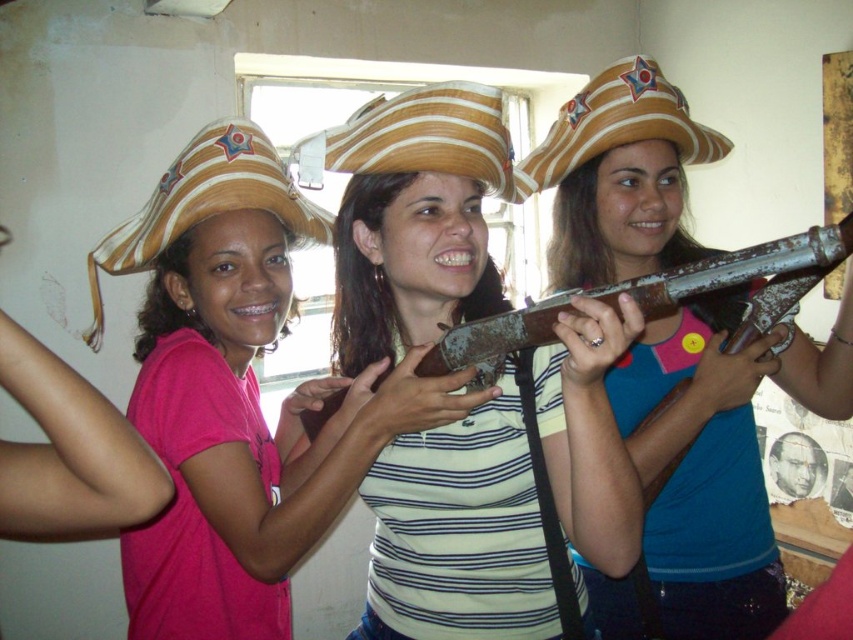
Question: From the image, what is the correct spatial relationship of matte brown rifle at center in relation to rusty metal shotgun at center?

Choices:
 (A) right
 (B) left

Answer: (B)

Question: Which point is farther to the camera?

Choices:
 (A) matte brown rifle at center
 (B) straw cowboy hat at left
 (C) rusty metal shotgun at center
 (D) matte brown hat at center

Answer: (B)

Question: Based on their relative distances, which object is nearer to the straw hat at center?

Choices:
 (A) rusty metal shotgun at center
 (B) straw cowboy hat at left
 (C) matte brown hat at center

Answer: (A)

Question: Is matte brown rifle at center to the left of straw hat with star emblem at upper right from the viewer's perspective?

Choices:
 (A) yes
 (B) no

Answer: (A)

Question: Which of the following is the closest to the observer?

Choices:
 (A) (428, 125)
 (B) (590, 147)
 (C) (190, 161)

Answer: (A)

Question: Considering the relative positions of matte brown rifle at center and straw hat with star emblem at upper right in the image provided, where is matte brown rifle at center located with respect to straw hat with star emblem at upper right?

Choices:
 (A) right
 (B) left

Answer: (B)